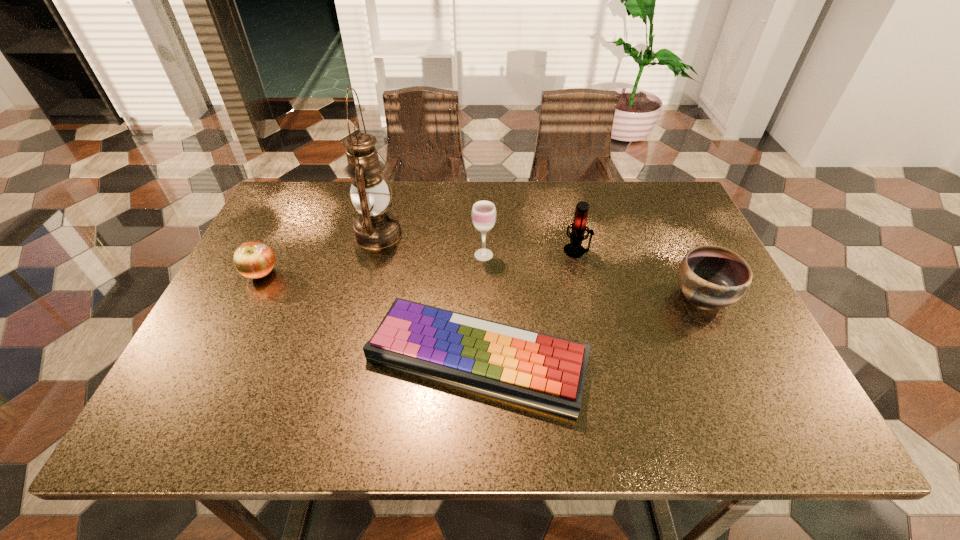
Where is `oil lamp`? This screenshot has height=540, width=960. oil lamp is located at coordinates click(x=376, y=227).

This screenshot has height=540, width=960. I want to click on wineglass, so click(483, 214).

Where is `microphone`? This screenshot has height=540, width=960. microphone is located at coordinates tap(574, 249).

Find the location of a particular element. The width and height of the screenshot is (960, 540). bowl is located at coordinates (710, 276).

You are a GUI agent. You are given a task and a screenshot of the screen. Output one action in this format:
    pyautogui.click(x=<x>, y=<y>)
    Task: Click on the third shortest object
    The width and height of the screenshot is (960, 540).
    Given the screenshot: What is the action you would take?
    pyautogui.click(x=710, y=276)

Locate an element on the screen. Image resolution: width=960 pixels, height=540 pixels. the fifth tallest object is located at coordinates (255, 260).

The width and height of the screenshot is (960, 540). Find the location of `apple`. apple is located at coordinates (255, 260).

I want to click on the shortest object, so click(x=542, y=371).

I want to click on free space located on the left of the tallest object, so click(x=272, y=234).

Find the location of `vacant region located on the right of the wineglass`. vacant region located on the right of the wineglass is located at coordinates (556, 255).